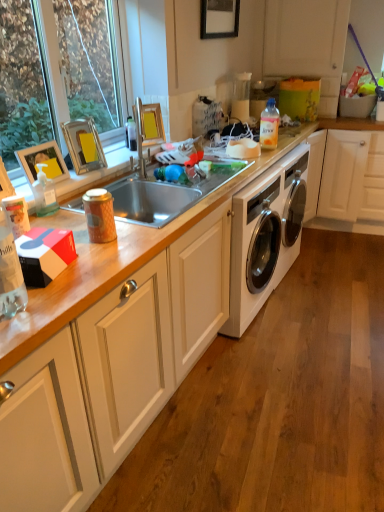
Find the location of `vacant space situated above white matte cabinet at lower left, the 2th cabinetry viewed from the top (from a real-world perspective)`. vacant space situated above white matte cabinet at lower left, the 2th cabinetry viewed from the top (from a real-world perspective) is located at coordinates (309, 342).